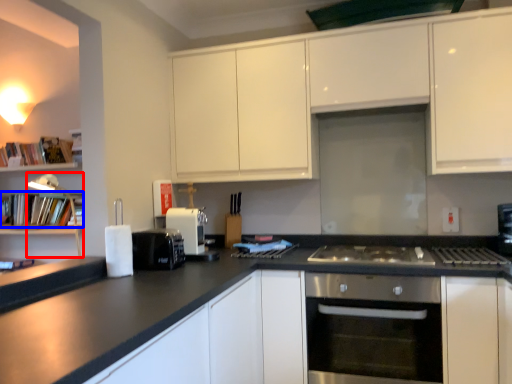
Question: Which point is further to the camera, lamp (highlighted by a red box) or book (highlighted by a blue box)?

Choices:
 (A) lamp
 (B) book

Answer: (B)